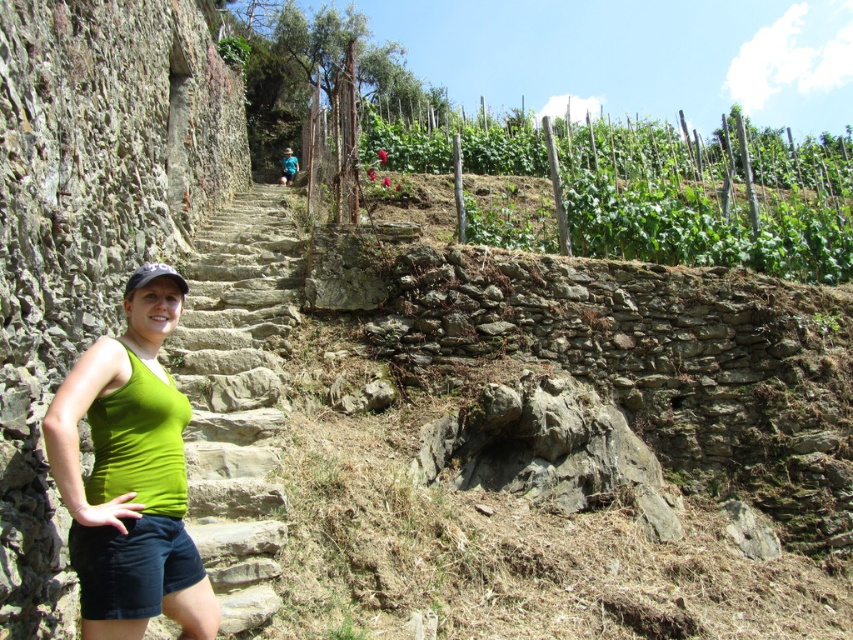
You are a hiker who wants to climb the stone stairs at center while wearing the dark blue corduroy shorts at lower left. Will the shorts be in your way when you step onto the stairs?

The stone stairs at center is positioned on the left side of dark blue corduroy shorts at lower left, so the shorts are located to the right of the stairs. Since the shorts are not in the path of the stairs, they should not be in your way when climbing.

You are a photographer trying to capture the woman in the image. The camera is set to focus on objects at point coordinates between 0.1 and 0.2 on the y axis. Will the green fabric tank top at center be in focus?

The green fabric tank top at center is located at point coordinates y value 0.154, which falls within the focus range of 0.1 to 0.2 on the y axis. Therefore, the green fabric tank top at center will be in focus.